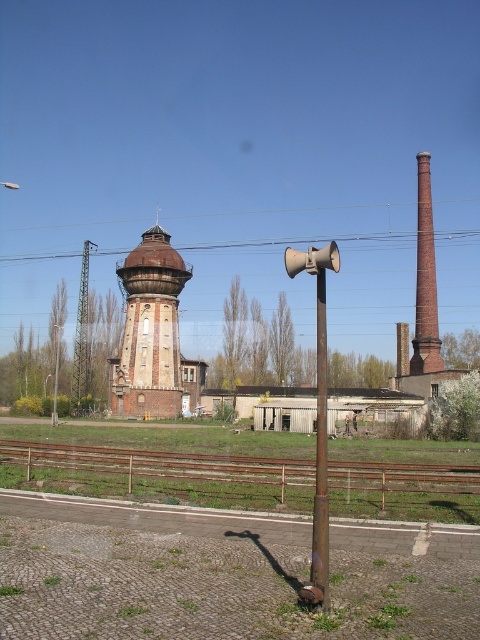
How far apart are red brick chimney at right and metallic pole at center?

red brick chimney at right and metallic pole at center are 38.64 meters apart.

Who is positioned more to the left, red brick chimney at right or metallic pole at center?

metallic pole at center is more to the left.

Does point (433, 273) lie in front of point (322, 349)?

No, (433, 273) is behind (322, 349).

At what (x,y) coordinates should I click in order to perform the action: click on red brick chimney at right. Please return your answer as a coordinate pair (x, y). The image size is (480, 640). Looking at the image, I should click on (x=424, y=280).

Is red brick chimney at right further to camera compared to brick chimney at center right?

That is False.

From the picture: Who is higher up, red brick chimney at right or brick chimney at center right?

red brick chimney at right is higher up.

At what (x,y) coordinates should I click in order to perform the action: click on red brick chimney at right. Please return your answer as a coordinate pair (x, y). The height and width of the screenshot is (640, 480). Looking at the image, I should click on (424, 280).

Does brick textured water tower at center have a larger size compared to metallic pole at center?

No, brick textured water tower at center is not bigger than metallic pole at center.

In the scene shown: Between brick textured water tower at center and metallic pole at center, which one appears on the right side from the viewer's perspective?

Positioned to the right is metallic pole at center.

Where is `brick textured water tower at center`? The image size is (480, 640). brick textured water tower at center is located at coordinates (149, 330).